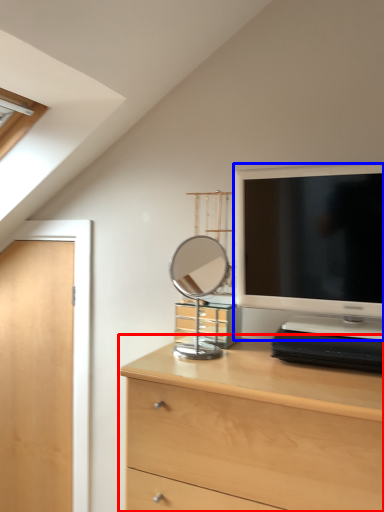
Question: Which point is further to the camera, chest of drawers (highlighted by a red box) or television (highlighted by a blue box)?

Choices:
 (A) chest of drawers
 (B) television

Answer: (B)